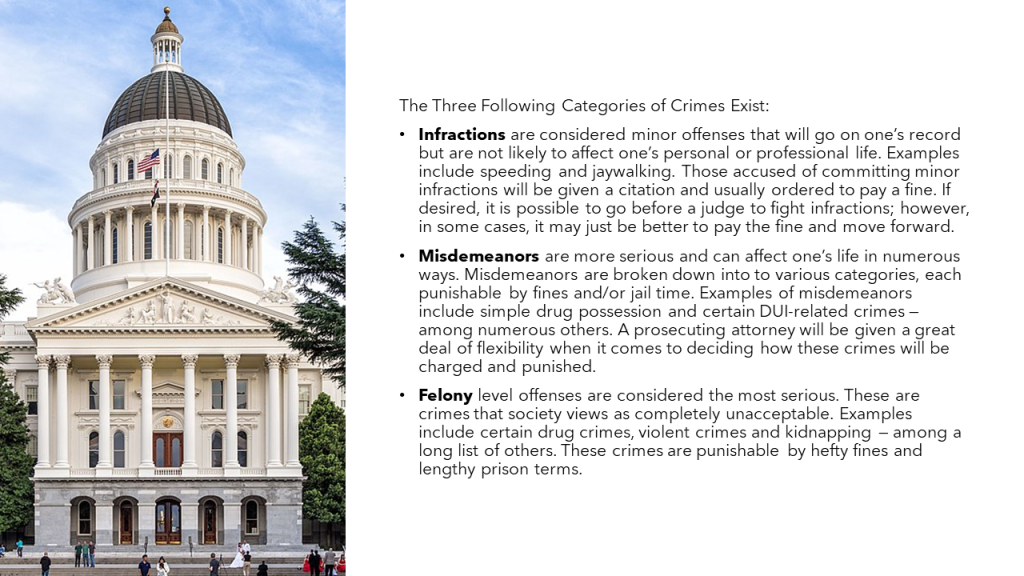
Locate an element on the screen. The width and height of the screenshot is (1024, 576). door is located at coordinates (207, 529), (121, 532), (162, 438), (167, 522).